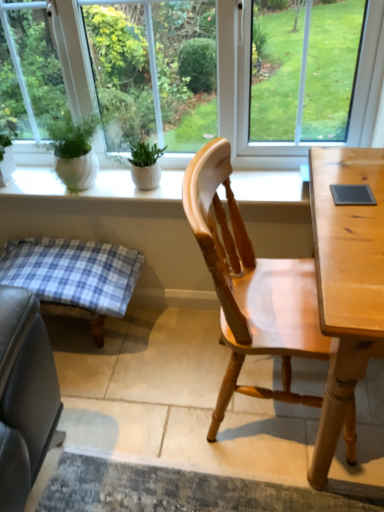
Image resolution: width=384 pixels, height=512 pixels. In order to click on spots to the right of green matte plant at center in this screenshot , I will do `click(172, 179)`.